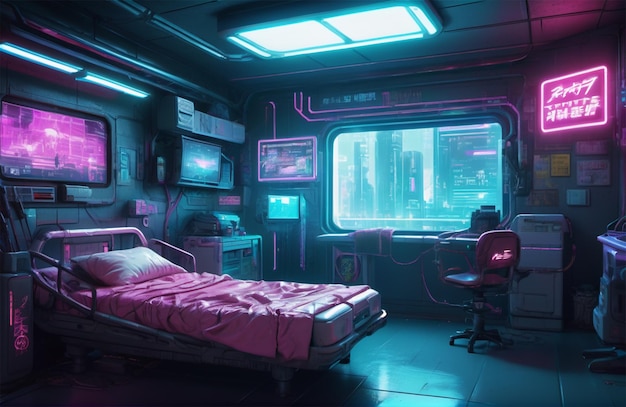
Find the location of a particular element. The width and height of the screenshot is (626, 407). neon purple sign is located at coordinates (566, 108).